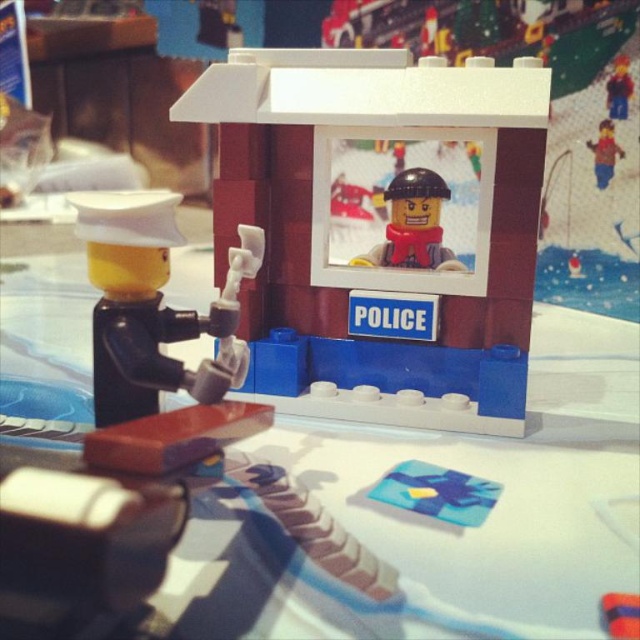
Question: Which object is closer to the camera taking this photo?

Choices:
 (A) matte red minifigure at upper right
 (B) blue plastic card at center
 (C) matte red minifigure at center
 (D) matte plastic police booth at center

Answer: (B)

Question: Does blue plastic card at center appear under smooth plastic minifigure at upper right?

Choices:
 (A) no
 (B) yes

Answer: (B)

Question: Does matte black minifigure at left have a greater width compared to matte red minifigure at center?

Choices:
 (A) no
 (B) yes

Answer: (B)

Question: Which object is closer to the camera taking this photo?

Choices:
 (A) matte black minifigure at left
 (B) blue plastic card at center
 (C) white plastic table at center

Answer: (C)

Question: Can you confirm if white plastic table at center is positioned above smooth plastic minifigure at upper right?

Choices:
 (A) yes
 (B) no

Answer: (B)

Question: Which point appears closest to the camera in this image?

Choices:
 (A) (589, 147)
 (B) (618, 65)
 (C) (148, 198)
 (D) (298, 552)

Answer: (D)